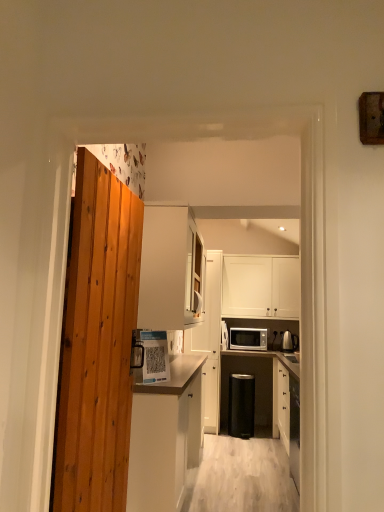
How much space does metallic silver kettle at right, placed as the 1th appliance when sorted from back to front, occupy vertically?

metallic silver kettle at right, placed as the 1th appliance when sorted from back to front, is 10.79 inches tall.

The image size is (384, 512). What do you see at coordinates (241, 405) in the screenshot?
I see `black plastic trash can at center, positioned as the 2th appliance in front-to-back order` at bounding box center [241, 405].

You are a GUI agent. You are given a task and a screenshot of the screen. Output one action in this format:
    pyautogui.click(x=<x>, y=<y>)
    Task: Click on the white matte cabinet at center, arranged as the fourth cabinetry when viewed from the right
    
    Given the screenshot: What is the action you would take?
    pyautogui.click(x=165, y=436)

Where is `white matte cabinet at upper center, the second cabinetry viewed from the left`? The height and width of the screenshot is (512, 384). white matte cabinet at upper center, the second cabinetry viewed from the left is located at coordinates (169, 268).

Identify the location of metallic silver kettle at right, the first appliance in the right-to-left sequence. This screenshot has height=512, width=384. (289, 341).

From a real-world perspective, which is physically above, white matte cabinet at upper center, the third cabinetry from the left, or matte white microwave at center?

white matte cabinet at upper center, the third cabinetry from the left, is physically above.

Is white matte cabinet at upper center, which is the second cabinetry in right-to-left order, inside the boundaries of matte white microwave at center, or outside?

white matte cabinet at upper center, which is the second cabinetry in right-to-left order, is not inside matte white microwave at center, it's outside.

Is white matte cabinet at upper center, which is the second cabinetry in right-to-left order, at the right side of matte white microwave at center?

In fact, white matte cabinet at upper center, which is the second cabinetry in right-to-left order, is to the left of matte white microwave at center.

Does white matte cabinet at upper center, which is the second cabinetry in right-to-left order, have a greater height compared to white matte cabinet at upper center, the third cabinetry positioned from the right?

Yes.

Is white matte cabinet at upper center, the third cabinetry from the left, at the right side of white matte cabinet at upper center, the second cabinetry viewed from the left?

Indeed, white matte cabinet at upper center, the third cabinetry from the left, is positioned on the right side of white matte cabinet at upper center, the second cabinetry viewed from the left.

Image resolution: width=384 pixels, height=512 pixels. In order to click on the 2nd cabinetry below the white matte cabinet at upper center, the third cabinetry positioned from the right (from the image's perspective) in this screenshot , I will do `click(210, 340)`.

Do you think white matte cabinet at upper center, the third cabinetry from the left, is within white matte cabinet at upper center, the second cabinetry viewed from the left, or outside of it?

white matte cabinet at upper center, the third cabinetry from the left, lies outside white matte cabinet at upper center, the second cabinetry viewed from the left.

Is white matte cabinet at upper center, arranged as the fourth cabinetry when viewed from the left, closer to the viewer compared to black plastic trash can at center, placed as the first appliance when sorted from bottom to top?

No, white matte cabinet at upper center, arranged as the fourth cabinetry when viewed from the left, is behind black plastic trash can at center, placed as the first appliance when sorted from bottom to top.

Is black plastic trash can at center, positioned as the 2th appliance in front-to-back order, completely or partially inside white matte cabinet at upper center, arranged as the fourth cabinetry when viewed from the left?

No, black plastic trash can at center, positioned as the 2th appliance in front-to-back order, is located outside of white matte cabinet at upper center, arranged as the fourth cabinetry when viewed from the left.

Is white matte cabinet at upper center, which is counted as the 1th cabinetry, starting from the right, oriented away from black plastic trash can at center, which is the second appliance from back to front?

No, white matte cabinet at upper center, which is counted as the 1th cabinetry, starting from the right,'s orientation is not away from black plastic trash can at center, which is the second appliance from back to front.

Who is smaller, white matte cabinet at upper center, arranged as the fourth cabinetry when viewed from the left, or black plastic trash can at center, the third appliance from the top?

black plastic trash can at center, the third appliance from the top, is smaller.

Does white matte cabinet at upper center, arranged as the fourth cabinetry when viewed from the left, appear on the left side of matte white microwave at center?

No.

From the image's perspective, relative to matte white microwave at center, is white matte cabinet at upper center, which is counted as the 1th cabinetry, starting from the right, above or below?

From the image's perspective, white matte cabinet at upper center, which is counted as the 1th cabinetry, starting from the right, appears above matte white microwave at center.

Is white matte cabinet at upper center, arranged as the fourth cabinetry when viewed from the left, taller or shorter than matte white microwave at center?

white matte cabinet at upper center, arranged as the fourth cabinetry when viewed from the left, is taller than matte white microwave at center.

Starting from the metallic silver kettle at right, the second appliance in the top-to-bottom sequence, which appliance is the 2nd one in front? Please provide its 2D coordinates.

[(150, 356)]

Considering the positions of objects white glossy paper at center, which is the first appliance in top-to-bottom order, and metallic silver kettle at right, the first appliance in the right-to-left sequence, in the image provided, who is more to the left, white glossy paper at center, which is the first appliance in top-to-bottom order, or metallic silver kettle at right, the first appliance in the right-to-left sequence,?

Positioned to the left is white glossy paper at center, which is the first appliance in top-to-bottom order.

Which object is further away from the camera taking this photo, white glossy paper at center, which is the first appliance in top-to-bottom order, or metallic silver kettle at right, which is the second appliance from bottom to top?

metallic silver kettle at right, which is the second appliance from bottom to top, is further from the camera.

Is white glossy paper at center, placed as the third appliance when sorted from bottom to top, bigger than metallic silver kettle at right, the second appliance in the top-to-bottom sequence?

No.

From a real-world perspective, which is physically above, white glossy paper at center, which appears as the first appliance when viewed from the front, or white matte cabinet at center, arranged as the fourth cabinetry when viewed from the right?

white glossy paper at center, which appears as the first appliance when viewed from the front, is physically above.

There is a white matte cabinet at center, acting as the first cabinetry starting from the left. Where is `the 2nd appliance above it (from the image's perspective)`? The image size is (384, 512). the 2nd appliance above it (from the image's perspective) is located at coordinates (150, 356).

Would you say white glossy paper at center, the 3th appliance in the back-to-front sequence, is outside white matte cabinet at center, arranged as the fourth cabinetry when viewed from the right?

white glossy paper at center, the 3th appliance in the back-to-front sequence, lies outside white matte cabinet at center, arranged as the fourth cabinetry when viewed from the right,'s area.

This screenshot has width=384, height=512. What are the coordinates of `cabinetry that is the 2nd object located below the white matte cabinet at upper center, the second cabinetry viewed from the left (from the image's perspective)` in the screenshot? It's located at (210, 340).

Is white matte cabinet at upper center, the third cabinetry positioned from the right, far away from white matte cabinet at upper center, the third cabinetry from the left?

Absolutely, white matte cabinet at upper center, the third cabinetry positioned from the right, is distant from white matte cabinet at upper center, the third cabinetry from the left.

Based on the photo, does white matte cabinet at upper center, the second cabinetry viewed from the left, have a larger size compared to white matte cabinet at upper center, which is the second cabinetry in right-to-left order?

Correct, white matte cabinet at upper center, the second cabinetry viewed from the left, is larger in size than white matte cabinet at upper center, which is the second cabinetry in right-to-left order.

From the image's perspective, between white matte cabinet at upper center, the second cabinetry viewed from the left, and white matte cabinet at upper center, which is the second cabinetry in right-to-left order, which one is located above?

white matte cabinet at upper center, the second cabinetry viewed from the left, appears higher in the image.

This screenshot has height=512, width=384. What are the coordinates of `microwave oven behind the white matte cabinet at upper center, the third cabinetry from the left` in the screenshot? It's located at (248, 338).

Starting from the white matte cabinet at upper center, the second cabinetry viewed from the left, which cabinetry is the 1st one to the right? Please provide its 2D coordinates.

[(210, 340)]

From the image, which object appears to be nearer to matte white microwave at center, black plastic trash can at center, acting as the second appliance starting from the left, or metallic silver kettle at right, the third appliance from the front?

The object closer to matte white microwave at center is metallic silver kettle at right, the third appliance from the front.

Estimate the real-world distances between objects in this image. Which object is closer to white matte cabinet at upper center, which is counted as the 1th cabinetry, starting from the right, white glossy paper at center, the third appliance positioned from the right, or matte white microwave at center?

matte white microwave at center is closer to white matte cabinet at upper center, which is counted as the 1th cabinetry, starting from the right.

Considering their positions, is white matte cabinet at upper center, the third cabinetry from the left, positioned further to white glossy paper at center, the third appliance positioned from the right, than black plastic trash can at center, acting as the second appliance starting from the left?

black plastic trash can at center, acting as the second appliance starting from the left.

From the image, which object appears to be nearer to white matte cabinet at upper center, the third cabinetry positioned from the right, matte white microwave at center or black plastic trash can at center, which is the second appliance from back to front?

matte white microwave at center is closer to white matte cabinet at upper center, the third cabinetry positioned from the right.

Based on their spatial positions, is white matte cabinet at upper center, the second cabinetry viewed from the left, or matte white microwave at center closer to black plastic trash can at center, positioned as the 2th appliance in front-to-back order?

matte white microwave at center is positioned closer to the anchor black plastic trash can at center, positioned as the 2th appliance in front-to-back order.

Estimate the real-world distances between objects in this image. Which object is further from white glossy paper at center, the first appliance viewed from the left, matte white microwave at center or white matte cabinet at upper center, which is the second cabinetry in right-to-left order?

matte white microwave at center lies further to white glossy paper at center, the first appliance viewed from the left, than the other object.

From the image, which object appears to be nearer to white matte cabinet at upper center, which is the second cabinetry in right-to-left order, white matte cabinet at upper center, the third cabinetry positioned from the right, or black plastic trash can at center, the third appliance from the top?

Among the two, black plastic trash can at center, the third appliance from the top, is located nearer to white matte cabinet at upper center, which is the second cabinetry in right-to-left order.

Estimate the real-world distances between objects in this image. Which object is further from white matte cabinet at upper center, which is the second cabinetry in right-to-left order, white matte cabinet at upper center, arranged as the fourth cabinetry when viewed from the left, or white matte cabinet at center, arranged as the fourth cabinetry when viewed from the right?

The object further to white matte cabinet at upper center, which is the second cabinetry in right-to-left order, is white matte cabinet at upper center, arranged as the fourth cabinetry when viewed from the left.

Where is `appliance positioned between white glossy paper at center, the third appliance positioned from the right, and metallic silver kettle at right, the second appliance in the top-to-bottom sequence, from near to far`? The width and height of the screenshot is (384, 512). appliance positioned between white glossy paper at center, the third appliance positioned from the right, and metallic silver kettle at right, the second appliance in the top-to-bottom sequence, from near to far is located at coordinates (241, 405).

Identify the location of microwave oven between white glossy paper at center, the third appliance positioned from the right, and white matte cabinet at upper center, arranged as the fourth cabinetry when viewed from the left, from front to back. (248, 338).

Find the location of a particular element. The height and width of the screenshot is (512, 384). appliance between white matte cabinet at upper center, the third cabinetry positioned from the right, and metallic silver kettle at right, placed as the 1th appliance when sorted from back to front, along the z-axis is located at coordinates (241, 405).

The height and width of the screenshot is (512, 384). Identify the location of microwave oven between white matte cabinet at upper center, arranged as the fourth cabinetry when viewed from the left, and black plastic trash can at center, positioned as the 2th appliance in front-to-back order, vertically. (248, 338).